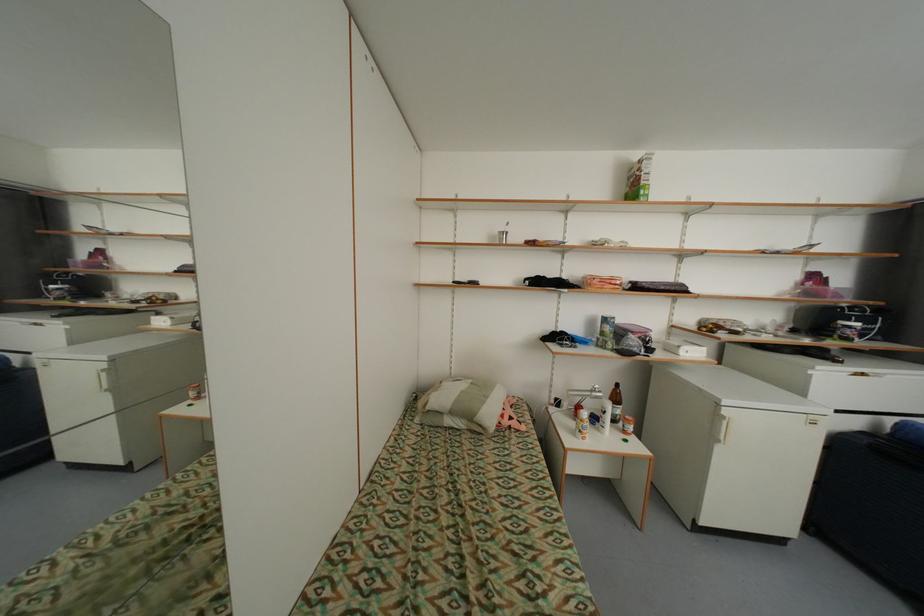
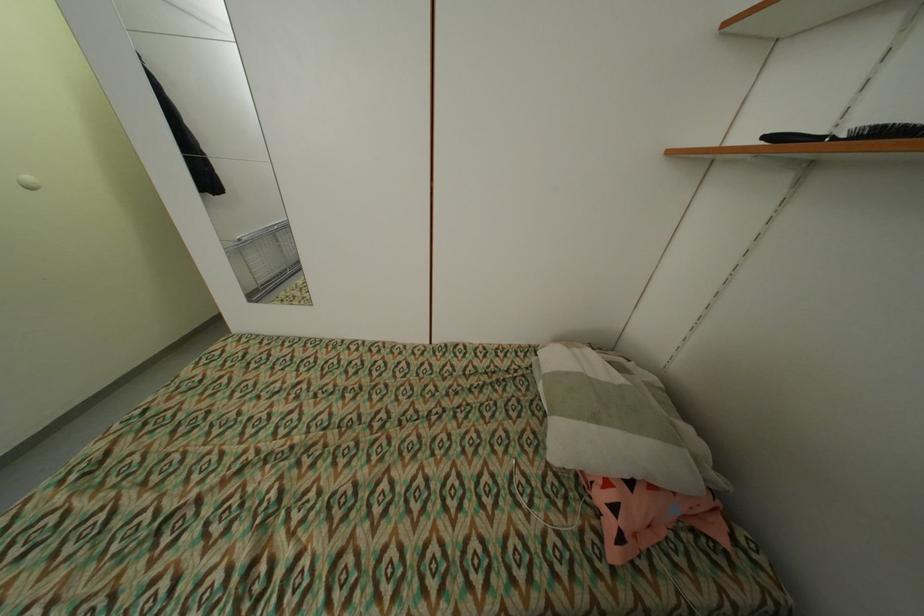
Find the pixel in the second image that matches (512,423) in the first image.

(606, 498)